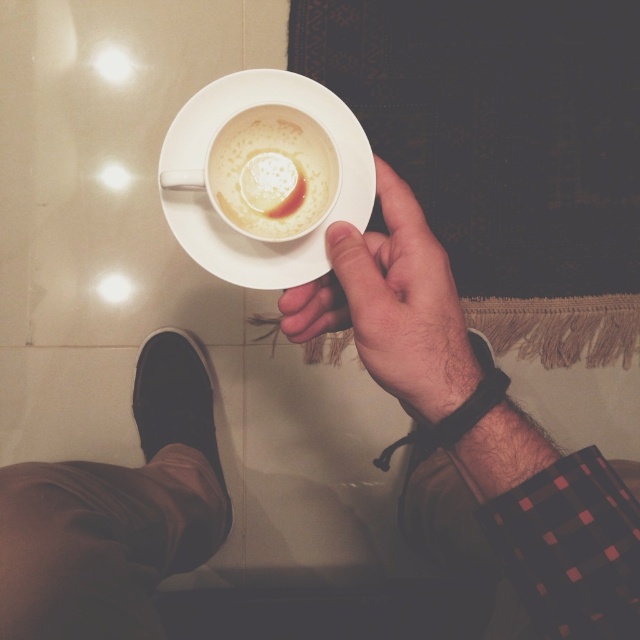
Question: Is smooth skin hand at center bigger than black suede shoe at lower left?

Choices:
 (A) no
 (B) yes

Answer: (B)

Question: Where is white matte cup at center located in relation to black suede shoe at lower left in the image?

Choices:
 (A) above
 (B) below

Answer: (A)

Question: Which of the following is the farthest from the observer?

Choices:
 (A) (168, 221)
 (B) (230, 154)

Answer: (A)

Question: Which point appears farthest from the camera in this image?

Choices:
 (A) (278, 221)
 (B) (154, 339)

Answer: (B)

Question: In this image, where is smooth skin hand at center located relative to white matte cup at center?

Choices:
 (A) below
 (B) above

Answer: (A)

Question: Which point is closer to the camera?

Choices:
 (A) (317, 184)
 (B) (304, 259)
 (C) (196, 352)
 (D) (337, 250)

Answer: (D)